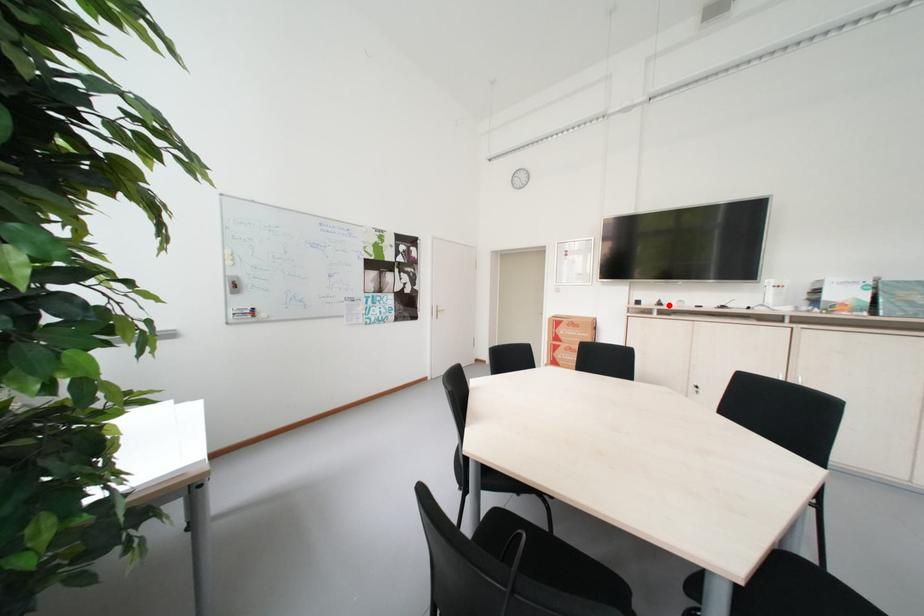
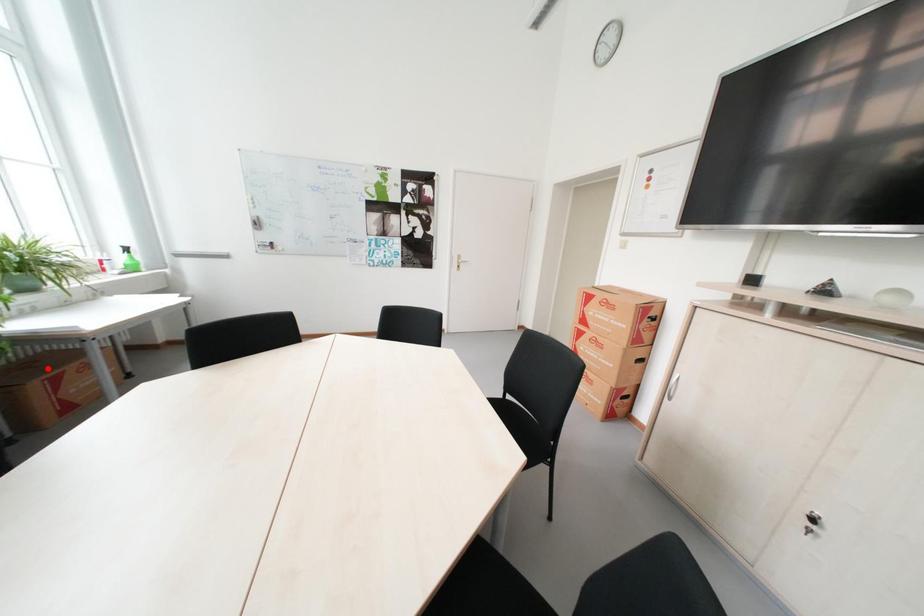
From the picture: I am providing you with two images of the same scene from different viewpoints. A red point is marked on the first image and another point is marked on the second image. Is the marked point in image1 the same physical position as the marked point in image2?

No